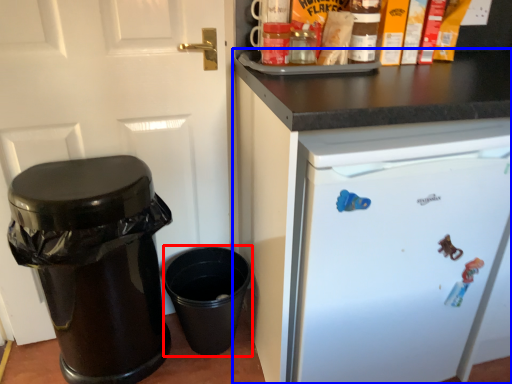
Question: Which object appears closest to the camera in this image, crock pot (highlighted by a red box) or cabinetry (highlighted by a blue box)?

Choices:
 (A) crock pot
 (B) cabinetry

Answer: (B)